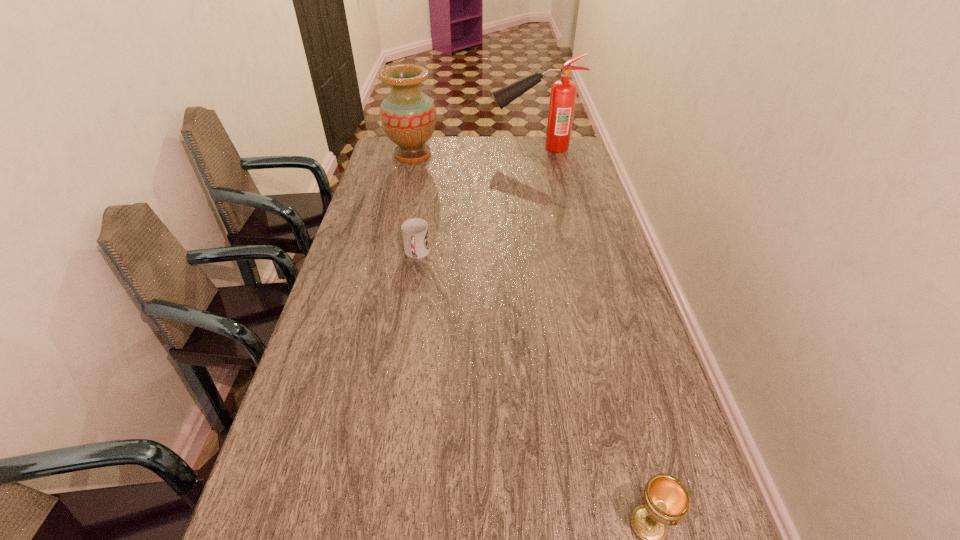
Identify the location of fire extinguisher. The height and width of the screenshot is (540, 960). pos(563,92).

Where is `vase`? The height and width of the screenshot is (540, 960). vase is located at coordinates (408, 116).

Find the location of `cup`. cup is located at coordinates (415, 232).

Locate an element on the screen. This screenshot has width=960, height=540. the third farthest object is located at coordinates (415, 232).

Where is `vacant space situated 0.240m at the nozzle of the fire extinguisher`? This screenshot has height=540, width=960. vacant space situated 0.240m at the nozzle of the fire extinguisher is located at coordinates (438, 148).

Locate an element on the screen. Image resolution: width=960 pixels, height=540 pixels. free region located 0.060m at the nozzle of the fire extinguisher is located at coordinates (478, 148).

Locate an element on the screen. vacant space located 0.140m at the nozzle of the fire extinguisher is located at coordinates (460, 148).

Where is `vacant space located 0.140m on the right of the vase`? This screenshot has width=960, height=540. vacant space located 0.140m on the right of the vase is located at coordinates (471, 155).

I want to click on free region located 0.170m on the side of the third farthest object where the handle is located, so click(x=409, y=306).

Locate an element on the screen. fire extinguisher that is at the far edge is located at coordinates (563, 92).